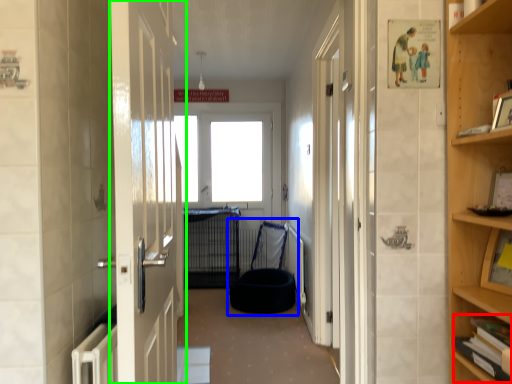
Question: Which object is the closest to the book (highlighted by a red box)? Choose among these: bean bag chair (highlighted by a blue box) or door (highlighted by a green box).

Choices:
 (A) bean bag chair
 (B) door

Answer: (B)